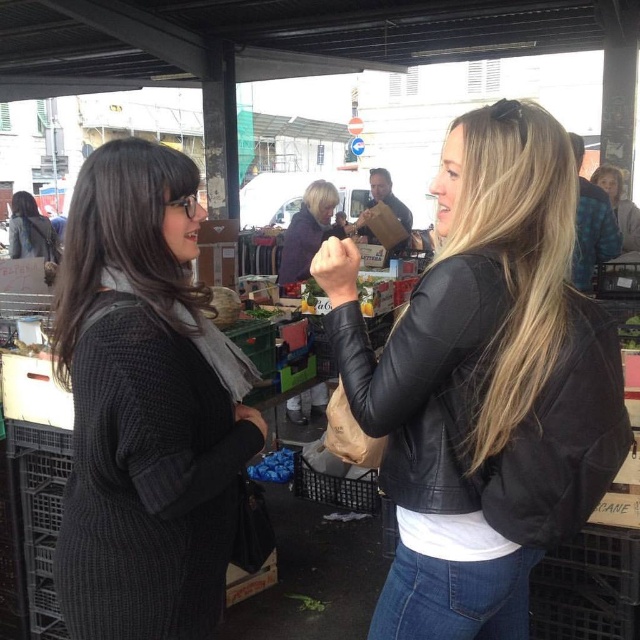
Can you confirm if black leather jacket at right is smaller than dark gray knitted sweater at left?

Actually, black leather jacket at right might be larger than dark gray knitted sweater at left.

This screenshot has height=640, width=640. Describe the element at coordinates (483, 384) in the screenshot. I see `black leather jacket at right` at that location.

Locate an element on the screen. black leather jacket at right is located at coordinates (483, 384).

Can you confirm if black leather jacket at right is thinner than dark gray sweater at upper left?

Correct, black leather jacket at right's width is less than dark gray sweater at upper left's.

Describe the element at coordinates (483, 384) in the screenshot. I see `black leather jacket at right` at that location.

Which is in front, point (387, 589) or point (29, 228)?

Point (387, 589) is more forward.

This screenshot has height=640, width=640. I want to click on black leather jacket at right, so (483, 384).

Which is below, dark gray knitted sweater at left or dark gray sweater at upper left?

Positioned lower is dark gray knitted sweater at left.

Can you confirm if dark gray knitted sweater at left is thinner than dark gray sweater at upper left?

Yes.

Measure the distance between dark gray knitted sweater at left and camera.

1.02 meters

Identify the location of dark gray knitted sweater at left. The image size is (640, 640). (145, 404).